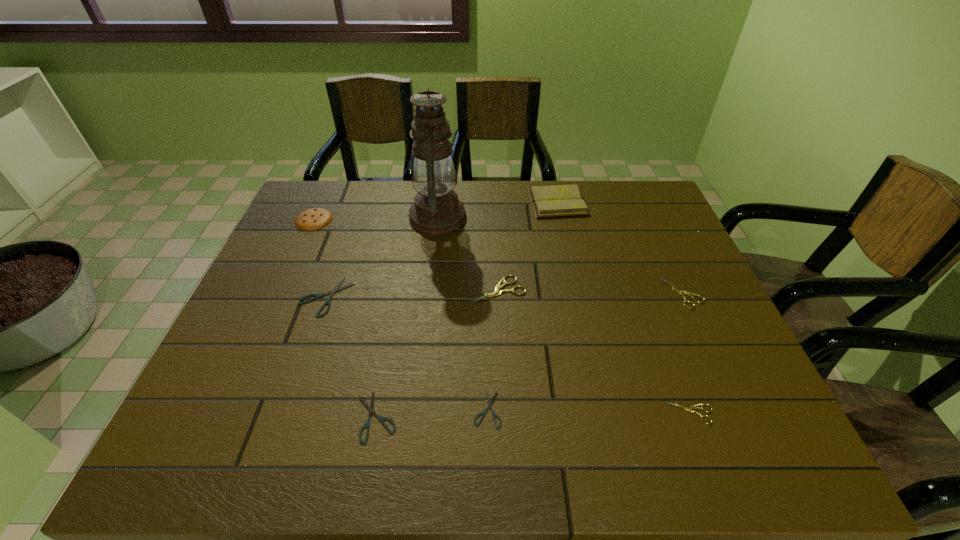
The height and width of the screenshot is (540, 960). Identify the location of object situated at the far left corner. (312, 219).

The width and height of the screenshot is (960, 540). Identify the location of object at the near right corner. (690, 409).

Locate an element on the screen. This screenshot has height=540, width=960. vacant region at the far edge of the desktop is located at coordinates (526, 217).

The width and height of the screenshot is (960, 540). Identify the location of blank space at the near edge of the desktop. (285, 449).

Find the location of `vacant space at the left edge of the desktop`. vacant space at the left edge of the desktop is located at coordinates (313, 243).

Locate an element on the screen. free region at the right edge of the desktop is located at coordinates (711, 309).

The width and height of the screenshot is (960, 540). I want to click on vacant area at the far left corner of the desktop, so click(x=325, y=182).

Locate an element on the screen. This screenshot has width=960, height=540. empty space that is in between the second object from right to left and the smallest black shears is located at coordinates (589, 411).

Locate an element on the screen. free space that is in between the second tallest shears and the tallest shears is located at coordinates (590, 292).

Where is `free point between the smallest black shears and the second smallest black shears`? The height and width of the screenshot is (540, 960). free point between the smallest black shears and the second smallest black shears is located at coordinates (432, 413).